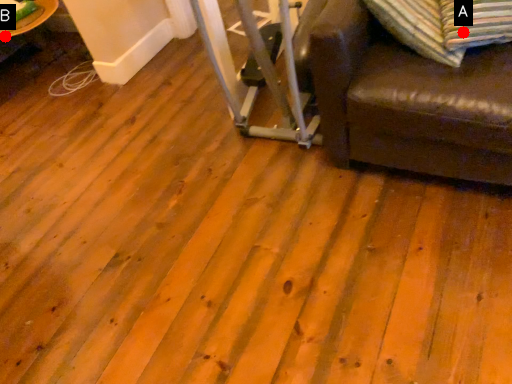
Question: Two points are circled on the image, labeled by A and B beside each circle. Which point is further to the camera?

Choices:
 (A) A is further
 (B) B is further

Answer: (B)